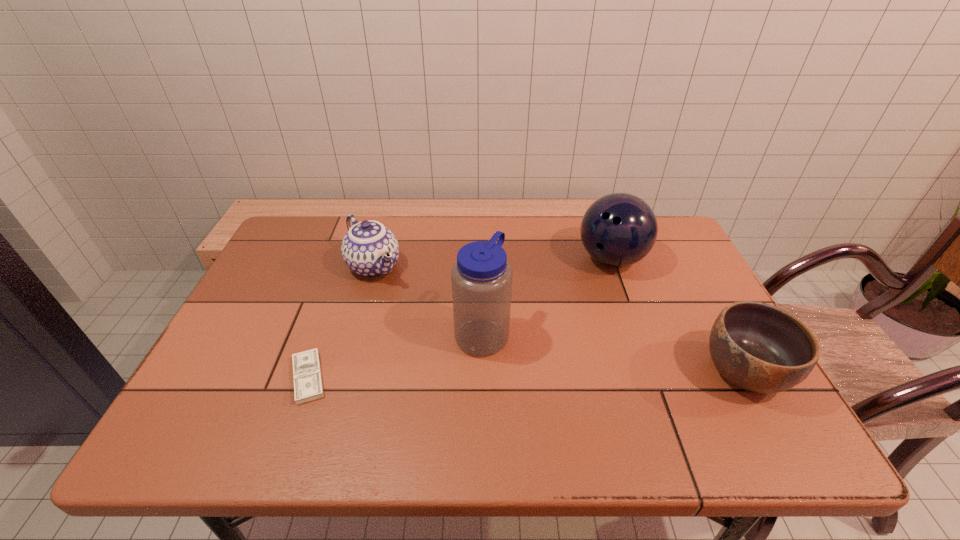
At what (x,y) coordinates should I click in order to perform the action: click on the second closest object relative to the rightmost object. Please return your answer as a coordinate pair (x, y). This screenshot has height=540, width=960. Looking at the image, I should click on (481, 278).

Identify which object is the fourth nearest to the bowl. Please provide its 2D coordinates. Your answer should be formatted as a tuple, i.e. [(x, y)], where the tuple contains the x and y coordinates of a point satisfying the conditions above.

[(307, 376)]

The image size is (960, 540). I want to click on vacant area that satisfies the following two spatial constraints: 1. on the back side of the money; 2. on the right side of the water bottle, so click(324, 334).

Where is `vacant space that satisfies the following two spatial constraints: 1. on the front side of the chinaware; 2. on the right side of the rightmost object`? vacant space that satisfies the following two spatial constraints: 1. on the front side of the chinaware; 2. on the right side of the rightmost object is located at coordinates point(343,372).